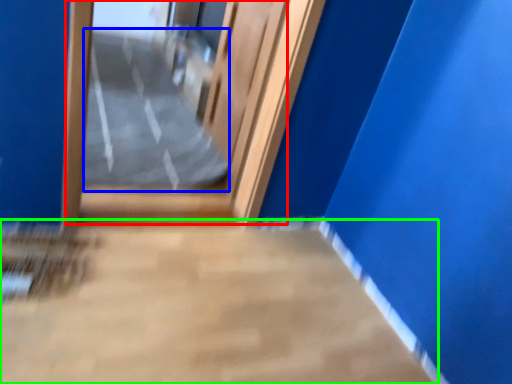
Question: Considering the real-world distances, which object is farthest from door (highlighted by a red box)? path (highlighted by a blue box) or concrete (highlighted by a green box)?

Choices:
 (A) path
 (B) concrete

Answer: (B)